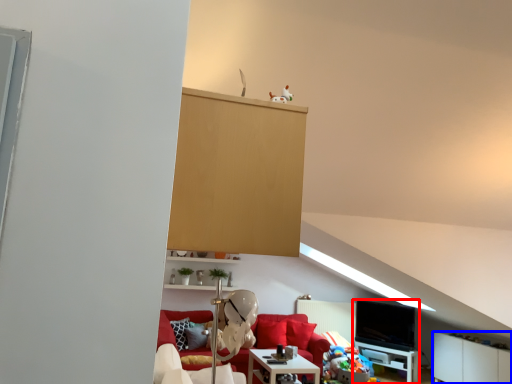
Question: Which object is closer to the camera taking this photo, entertainment center (highlighted by a red box) or cabinetry (highlighted by a blue box)?

Choices:
 (A) entertainment center
 (B) cabinetry

Answer: (B)